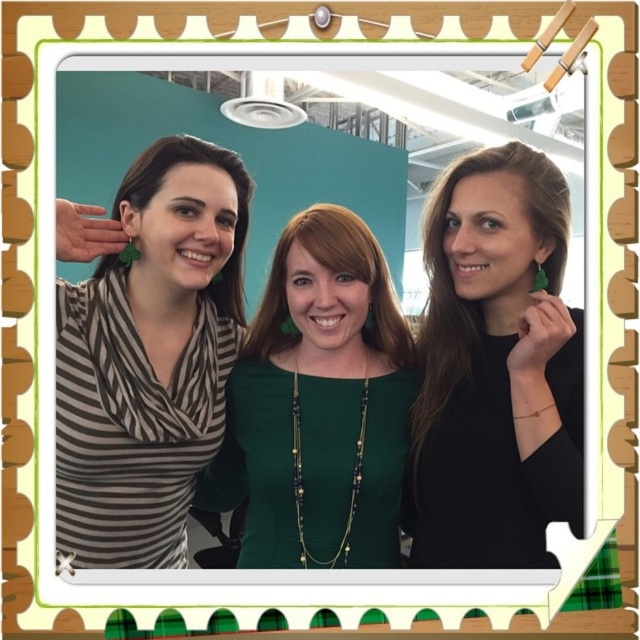
Question: Is striped fabric scarf at left closer to the viewer compared to brownhair at left?

Choices:
 (A) no
 (B) yes

Answer: (B)

Question: Based on their relative distances, which object is nearer to the green matte earrings at center?

Choices:
 (A) green matte dress at center
 (B) brownhair at left
 (C) smooth brown hair at center
 (D) striped fabric scarf at left

Answer: (A)

Question: Which is nearer to the green matte dress at center?

Choices:
 (A) smooth brown hair at center
 (B) striped fabric scarf at left

Answer: (A)

Question: Which object is farther from the camera taking this photo?

Choices:
 (A) smooth brown hair at center
 (B) brownhair at left
 (C) striped fabric scarf at left
 (D) green matte earrings at center

Answer: (B)

Question: Is green matte earrings at center wider than brownhair at left?

Choices:
 (A) no
 (B) yes

Answer: (A)

Question: Where is green matte earrings at center located in relation to smooth brown hair at center in the image?

Choices:
 (A) right
 (B) left

Answer: (A)